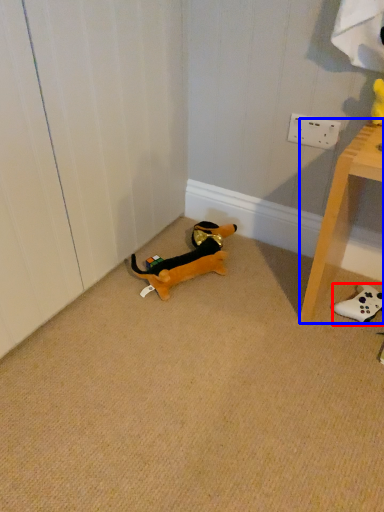
Question: Which of the following is the closest to the observer, toy (highlighted by a red box) or furniture (highlighted by a blue box)?

Choices:
 (A) toy
 (B) furniture

Answer: (B)